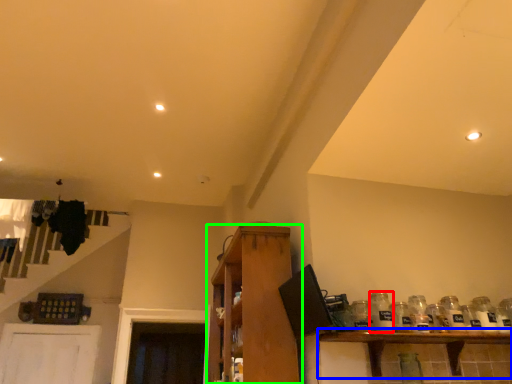
Question: Based on their relative distances, which object is nearer to glass bottle (highlighted by a red box)? Choose from shelf (highlighted by a blue box) and shelf (highlighted by a green box).

Choices:
 (A) shelf
 (B) shelf

Answer: (A)